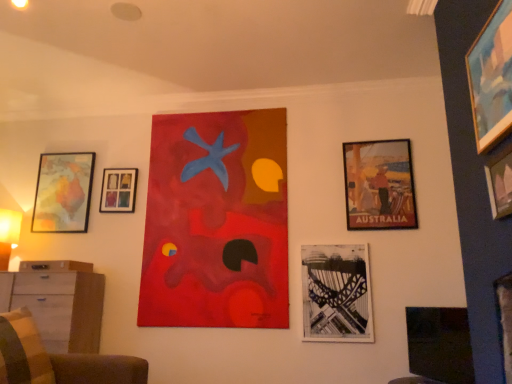
Where is `yellow fabric lampshade at left`? yellow fabric lampshade at left is located at coordinates (8, 234).

In order to face wooden picture frame at upper left, which is the 2th picture frame from left to right, should I rotate leftwards or rightwards?

Rotate your view left by about 17.909°.

I want to click on plaid fabric pillow at lower left, so click(22, 350).

Would you say black paper bridge at lower center, the fourth picture frame viewed from the right, is outside wooden picture frame at upper left, which is the 2th picture frame in back-to-front order?

black paper bridge at lower center, the fourth picture frame viewed from the right, lies outside wooden picture frame at upper left, which is the 2th picture frame in back-to-front order,'s area.

From a real-world perspective, is black paper bridge at lower center, the 5th picture frame from the back, physically above wooden picture frame at upper left, which is the 2th picture frame in back-to-front order?

Actually, black paper bridge at lower center, the 5th picture frame from the back, is physically below wooden picture frame at upper left, which is the 2th picture frame in back-to-front order, in the real world.

Between black paper bridge at lower center, placed as the 3th picture frame when sorted from front to back, and wooden picture frame at upper left, which is the 2th picture frame in back-to-front order, which one is positioned behind?

wooden picture frame at upper left, which is the 2th picture frame in back-to-front order, is further from the camera.

Starting from the black paper bridge at lower center, the fourth picture frame viewed from the right, which picture frame is the 2nd one to the left? Please provide its 2D coordinates.

[(118, 190)]

Is point (437, 316) behind point (14, 307)?

No, it is not.

From the image's perspective, which is below, matte black picture frame at lower right, the seventh picture frame positioned from the left, or wooden dresser at lower left?

From the image's view, wooden dresser at lower left is below.

Based on the photo, how many degrees apart are the facing directions of matte black picture frame at lower right, which is counted as the 2th picture frame, starting from the front, and wooden dresser at lower left?

matte black picture frame at lower right, which is counted as the 2th picture frame, starting from the front, and wooden dresser at lower left are facing 65.1 degrees away from each other.

Is matte black picture frame at lower right, which is the 6th picture frame in back-to-front order, inside the boundaries of wooden dresser at lower left, or outside?

matte black picture frame at lower right, which is the 6th picture frame in back-to-front order, is outside wooden dresser at lower left.

Between matte acrylic painting at center, the 4th picture frame when ordered from back to front, and wooden picture frame at upper right, the seventh picture frame positioned from the back, which one appears on the right side from the viewer's perspective?

wooden picture frame at upper right, the seventh picture frame positioned from the back, is more to the right.

In the scene shown: From a real-world perspective, which is physically below, matte acrylic painting at center, acting as the fifth picture frame starting from the right, or wooden picture frame at upper right, placed as the third picture frame when sorted from right to left?

From a 3D spatial view, matte acrylic painting at center, acting as the fifth picture frame starting from the right, is below.

From the picture: Is matte acrylic painting at center, acting as the 4th picture frame starting from the front, positioned with its back to wooden picture frame at upper right, placed as the third picture frame when sorted from right to left?

matte acrylic painting at center, acting as the 4th picture frame starting from the front, does not have its back to wooden picture frame at upper right, placed as the third picture frame when sorted from right to left.

From a real-world perspective, is matte paper poster at right, which appears as the third picture frame when viewed from the back, positioned under black paper bridge at lower center, which is counted as the fourth picture frame, starting from the left, based on gravity?

No, from a real-world perspective, matte paper poster at right, which appears as the third picture frame when viewed from the back, is not under black paper bridge at lower center, which is counted as the fourth picture frame, starting from the left.

Considering the positions of points (351, 153) and (324, 255), is point (351, 153) farther from camera compared to point (324, 255)?

That is True.

Considering the relative positions of matte paper poster at right, which appears as the third picture frame when viewed from the back, and black paper bridge at lower center, placed as the 3th picture frame when sorted from front to back, in the image provided, is matte paper poster at right, which appears as the third picture frame when viewed from the back, to the left of black paper bridge at lower center, placed as the 3th picture frame when sorted from front to back, from the viewer's perspective?

No.

Is point (375, 213) closer or farther from the camera than point (4, 308)?

Clearly, point (375, 213) is more distant from the camera than point (4, 308).

I want to click on dresser directly beneath the matte paper poster at right, the fifth picture frame when ordered from front to back (from a real-world perspective), so click(58, 302).

Is matte paper poster at right, the fifth picture frame when ordered from front to back, outside of wooden dresser at lower left?

Yes.

Would you say matte paper poster at right, which appears as the third picture frame when viewed from the back, is part of matte wooden map at left, which ranks as the seventh picture frame in front-to-back order,'s contents?

No.

In terms of width, does matte wooden map at left, the 1th picture frame positioned from the back, look wider or thinner when compared to matte paper poster at right, which appears as the third picture frame when viewed from the back?

In the image, matte wooden map at left, the 1th picture frame positioned from the back, appears to be more narrow than matte paper poster at right, which appears as the third picture frame when viewed from the back.

Is the surface of matte wooden map at left, the 1th picture frame positioned from the back, in direct contact with matte paper poster at right, the 6th picture frame in the left-to-right sequence?

No, matte wooden map at left, the 1th picture frame positioned from the back, is not making contact with matte paper poster at right, the 6th picture frame in the left-to-right sequence.

Locate an element on the screen. The height and width of the screenshot is (384, 512). the 2nd picture frame in front of the matte wooden map at left, the 1th picture frame positioned from the back, starting your count from the anchor is located at coordinates (379, 185).

Considering the positions of objects matte black picture frame at lower right, the seventh picture frame positioned from the left, and matte paper poster at right, the fifth picture frame when ordered from front to back, in the image provided, who is more to the left, matte black picture frame at lower right, the seventh picture frame positioned from the left, or matte paper poster at right, the fifth picture frame when ordered from front to back,?

Positioned to the left is matte paper poster at right, the fifth picture frame when ordered from front to back.

Is matte black picture frame at lower right, the seventh picture frame positioned from the left, thinner than matte paper poster at right, which appears as the third picture frame when viewed from the back?

Incorrect, the width of matte black picture frame at lower right, the seventh picture frame positioned from the left, is not less than that of matte paper poster at right, which appears as the third picture frame when viewed from the back.

From a real-world perspective, who is located lower, matte black picture frame at lower right, which is counted as the 2th picture frame, starting from the front, or matte paper poster at right, the fifth picture frame when ordered from front to back?

matte black picture frame at lower right, which is counted as the 2th picture frame, starting from the front.

From a real-world perspective, count 4th picture frames upward from the black paper bridge at lower center, the 5th picture frame from the back, and point to it. Please provide its 2D coordinates.

[(118, 190)]

At what (x,y) coordinates should I click in order to perform the action: click on picture frame that is the 1st object located in front of the wooden dresser at lower left. Please return your answer as a coordinate pair (x, y). The image size is (512, 384). Looking at the image, I should click on (440, 344).

When comparing their distances from matte black picture frame at lower right, which is counted as the 2th picture frame, starting from the front, does black paper bridge at lower center, the fourth picture frame viewed from the right, or wooden dresser at lower left seem further?

wooden dresser at lower left is further to matte black picture frame at lower right, which is counted as the 2th picture frame, starting from the front.

Based on their spatial positions, is matte acrylic painting at center, which ranks as the 3th picture frame in left-to-right order, or velvet brown armchair at lower left further from wooden dresser at lower left?

matte acrylic painting at center, which ranks as the 3th picture frame in left-to-right order, is positioned further to the anchor wooden dresser at lower left.

When comparing their distances from velvet brown armchair at lower left, does wooden picture frame at upper right, placed as the third picture frame when sorted from right to left, or matte acrylic painting at center, which ranks as the 3th picture frame in left-to-right order, seem closer?

The object closer to velvet brown armchair at lower left is matte acrylic painting at center, which ranks as the 3th picture frame in left-to-right order.

From the image, which object appears to be farther from matte acrylic painting at center, the 4th picture frame when ordered from back to front, matte paper poster at right, the 2th picture frame positioned from the right, or plaid fabric pillow at lower left?

plaid fabric pillow at lower left lies further to matte acrylic painting at center, the 4th picture frame when ordered from back to front, than the other object.

Estimate the real-world distances between objects in this image. Which object is closer to black paper bridge at lower center, placed as the 3th picture frame when sorted from front to back, yellow fabric lampshade at left or matte brown drawer at left?

matte brown drawer at left is positioned closer to the anchor black paper bridge at lower center, placed as the 3th picture frame when sorted from front to back.

Which object lies further to the anchor point black paper bridge at lower center, which is counted as the fourth picture frame, starting from the left, matte wooden map at left, which ranks as the seventh picture frame in front-to-back order, or matte paper poster at right, the 6th picture frame in the left-to-right sequence?

Based on the image, matte wooden map at left, which ranks as the seventh picture frame in front-to-back order, appears to be further to black paper bridge at lower center, which is counted as the fourth picture frame, starting from the left.

Which object lies nearer to the anchor point black paper bridge at lower center, the 5th picture frame from the back, matte brown drawer at left or matte paper poster at right, the 2th picture frame positioned from the right?

Based on the image, matte paper poster at right, the 2th picture frame positioned from the right, appears to be nearer to black paper bridge at lower center, the 5th picture frame from the back.

Considering their positions, is matte brown drawer at left positioned closer to matte wooden map at left, which ranks as the seventh picture frame in front-to-back order, than matte black picture frame at lower right, which is the 6th picture frame in back-to-front order?

Among the two, matte brown drawer at left is located nearer to matte wooden map at left, which ranks as the seventh picture frame in front-to-back order.

Locate an element on the screen. The height and width of the screenshot is (384, 512). picture frame between matte wooden map at left, which is the seventh picture frame in right-to-left order, and matte acrylic painting at center, which ranks as the 3th picture frame in left-to-right order, from left to right is located at coordinates 118,190.

At what (x,y) coordinates should I click in order to perform the action: click on pillow situated between yellow fabric lampshade at left and matte black picture frame at lower right, the seventh picture frame positioned from the left, from left to right. Please return your answer as a coordinate pair (x, y). Looking at the image, I should click on (22, 350).

At what (x,y) coordinates should I click in order to perform the action: click on dresser between yellow fabric lampshade at left and matte acrylic painting at center, which ranks as the 3th picture frame in left-to-right order, in the horizontal direction. Please return your answer as a coordinate pair (x, y). This screenshot has height=384, width=512. Looking at the image, I should click on (58, 302).

The width and height of the screenshot is (512, 384). In order to click on dresser between velvet brown armchair at lower left and yellow fabric lampshade at left from front to back in this screenshot , I will do `click(58, 302)`.